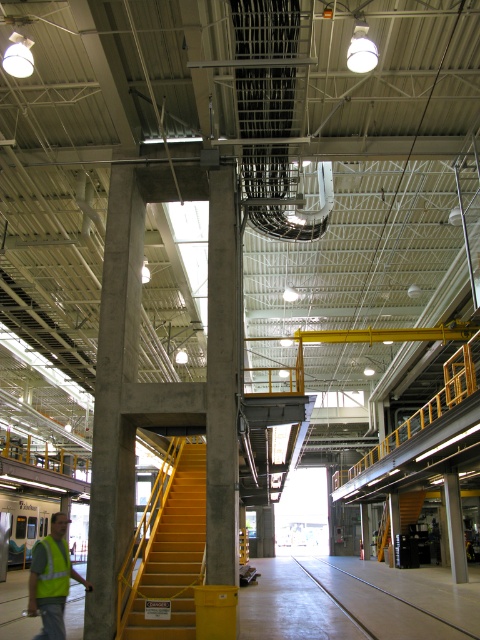
Question: Is concrete/stucco pillar at center smaller than high visibility fabric safety vest at lower left?

Choices:
 (A) no
 (B) yes

Answer: (A)

Question: Which of the following is the closest to the observer?

Choices:
 (A) yellow matte/stained stairs at center-left
 (B) high visibility fabric safety vest at lower left

Answer: (B)

Question: Considering the relative positions of concrete/stucco pillar at center and yellow matte/stained stairs at center-left in the image provided, where is concrete/stucco pillar at center located with respect to yellow matte/stained stairs at center-left?

Choices:
 (A) left
 (B) right

Answer: (B)

Question: Which of these objects is positioned farthest from the concrete/stucco pillar at center?

Choices:
 (A) yellow matte/stained stairs at center-left
 (B) reflective yellow vest at lower left
 (C) high visibility fabric safety vest at lower left

Answer: (A)

Question: Considering the relative positions of concrete/stucco pillar at center and high visibility fabric safety vest at lower left in the image provided, where is concrete/stucco pillar at center located with respect to high visibility fabric safety vest at lower left?

Choices:
 (A) left
 (B) right

Answer: (B)

Question: Among these points, which one is farthest from the camera?

Choices:
 (A) (38, 560)
 (B) (51, 544)

Answer: (B)